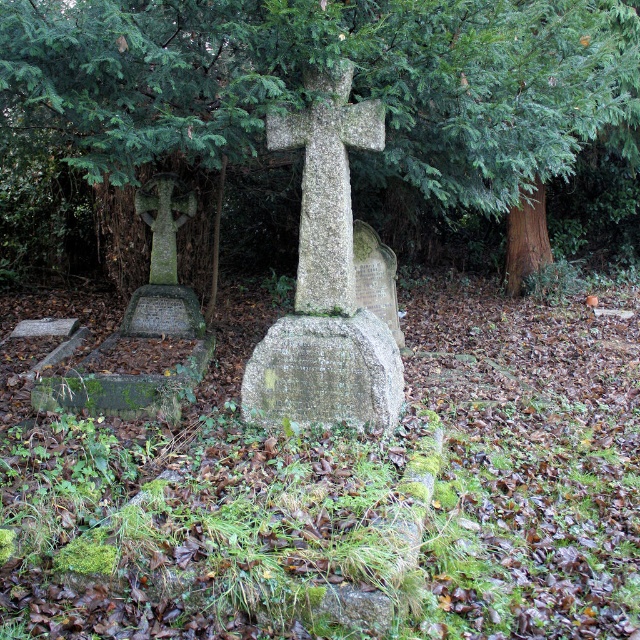
Does granite gravestone at center have a greater width compared to speckled stone cross at center?

Correct, the width of granite gravestone at center exceeds that of speckled stone cross at center.

Does granite gravestone at center have a smaller size compared to speckled stone cross at center?

Correct, granite gravestone at center occupies less space than speckled stone cross at center.

Find the location of a particular element. The height and width of the screenshot is (640, 640). granite gravestone at center is located at coordinates (324, 372).

Is green textured tree at center to the left of speckled stone cross at center from the viewer's perspective?

In fact, green textured tree at center is to the right of speckled stone cross at center.

Is green textured tree at center taller than speckled stone cross at center?

Yes, green textured tree at center is taller than speckled stone cross at center.

You are a GUI agent. You are given a task and a screenshot of the screen. Output one action in this format:
    pyautogui.click(x=<x>, y=<y>)
    Task: Click on the green textured tree at center
    This screenshot has height=640, width=640.
    Given the screenshot: What is the action you would take?
    (x=353, y=83)

You are a GUI agent. You are given a task and a screenshot of the screen. Output one action in this format:
    pyautogui.click(x=<x>, y=<y>)
    Task: Click on the green textured tree at center
    The height and width of the screenshot is (640, 640).
    Given the screenshot: What is the action you would take?
    pyautogui.click(x=353, y=83)

Is green textured tree at center to the right of granite gravestone at center from the viewer's perspective?

Correct, you'll find green textured tree at center to the right of granite gravestone at center.

Is point (134, 72) closer to viewer compared to point (276, 413)?

Yes, it is in front of point (276, 413).

You are a GUI agent. You are given a task and a screenshot of the screen. Output one action in this format:
    pyautogui.click(x=<x>, y=<y>)
    Task: Click on the green textured tree at center
    
    Given the screenshot: What is the action you would take?
    pyautogui.click(x=353, y=83)